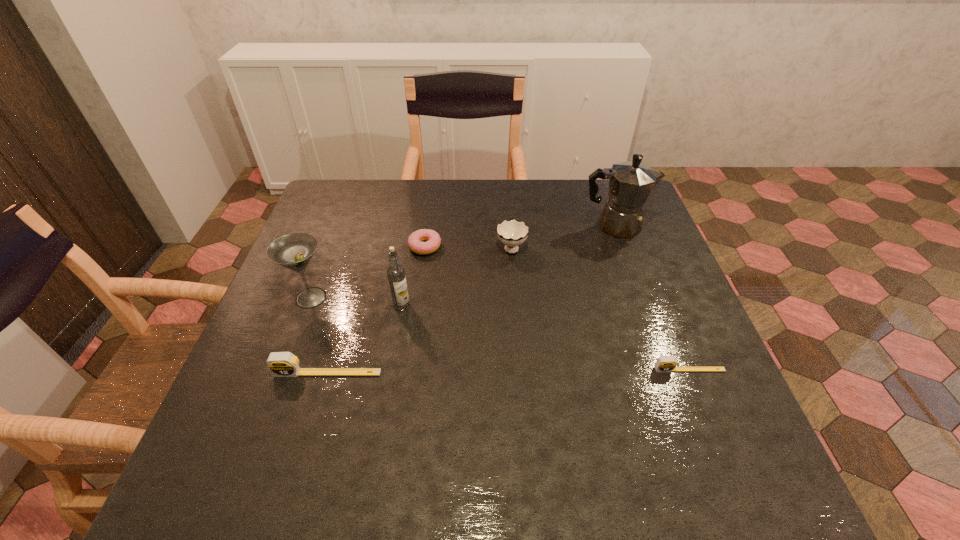
The image size is (960, 540). Identify the location of unoccupied position between the martini and the third shortest object. (320, 335).

The image size is (960, 540). Identify the location of vacant region between the left tape measure and the doughnut. (376, 310).

Locate an element on the screen. This screenshot has height=540, width=960. free spot between the martini and the fourth shortest object is located at coordinates (411, 272).

Image resolution: width=960 pixels, height=540 pixels. I want to click on vacant area between the tallest object and the vodka, so click(508, 266).

Where is `unoccupied area between the martini and the fifth object from left to right`? unoccupied area between the martini and the fifth object from left to right is located at coordinates (411, 272).

Find the location of a particular element. The height and width of the screenshot is (540, 960). vacant space that is in between the vodka and the shorter tape measure is located at coordinates (545, 338).

Find the location of a particular element. The height and width of the screenshot is (540, 960). vacant space that's between the martini and the vodka is located at coordinates (356, 302).

The image size is (960, 540). What are the coordinates of `free space between the martini and the cup` in the screenshot? It's located at (411, 272).

Identify the location of the third closest object to the cup. (396, 273).

The height and width of the screenshot is (540, 960). I want to click on object that can be found as the third closest to the doughnut, so pyautogui.click(x=294, y=251).